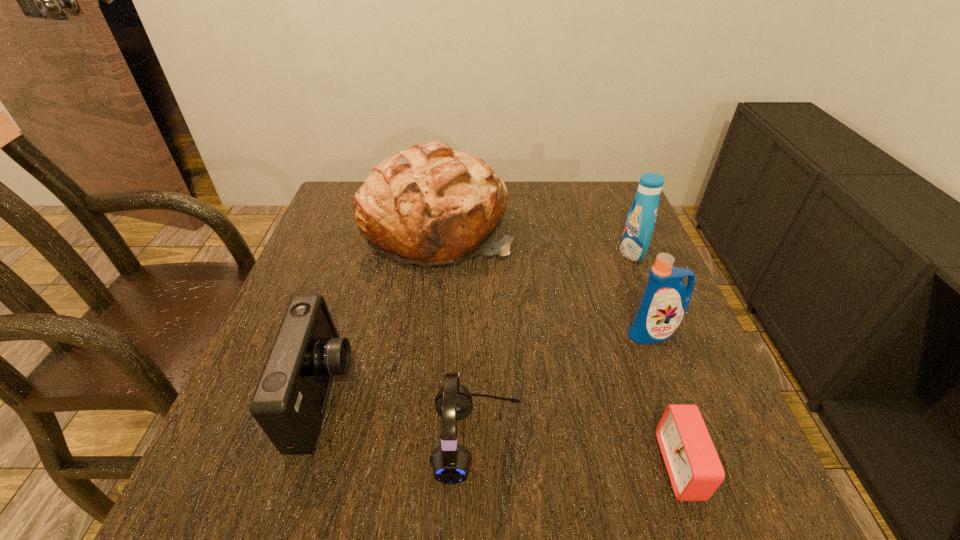
Locate an element on the screen. The height and width of the screenshot is (540, 960). bread is located at coordinates (428, 205).

Identify the location of the farther detergent. The width and height of the screenshot is (960, 540). (640, 222).

Where is `the third farthest object`? This screenshot has width=960, height=540. the third farthest object is located at coordinates (665, 301).

Where is `camera`? The height and width of the screenshot is (540, 960). camera is located at coordinates (289, 401).

Find the location of a particular element. The image size is (960, 540). headset is located at coordinates (451, 463).

Locate an element on the screen. The width and height of the screenshot is (960, 540). the shortest object is located at coordinates (695, 471).

This screenshot has height=540, width=960. I want to click on free space located on the right of the bread, so click(x=614, y=227).

Locate an element on the screen. The width and height of the screenshot is (960, 540). vacant space located on the front-facing side of the farther detergent is located at coordinates (514, 252).

Identify the location of vacant space located on the front-facing side of the farther detergent. (549, 252).

In order to click on blank area located 0.090m on the front-facing side of the farther detergent in this screenshot , I will do `click(585, 252)`.